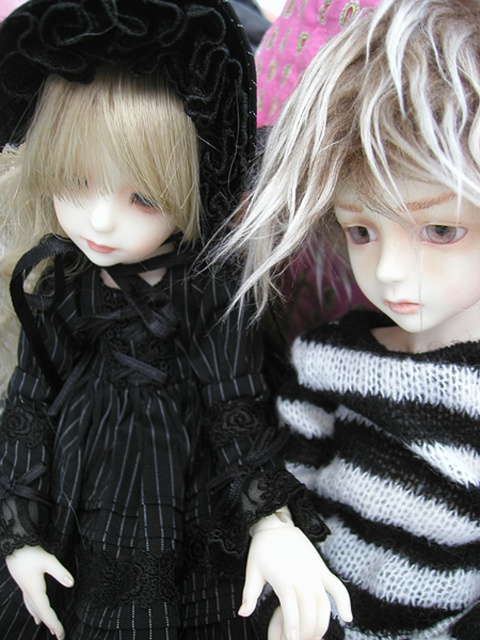
Can you confirm if matte black dress at left is positioned above black pinstriped dress at center?

Actually, matte black dress at left is below black pinstriped dress at center.

Which of these two, matte black dress at left or black pinstriped dress at center, stands shorter?

black pinstriped dress at center

Is point (322, 598) in front of point (261, 236)?

Yes.

In order to click on matte black dress at left in this screenshot , I will do `click(135, 337)`.